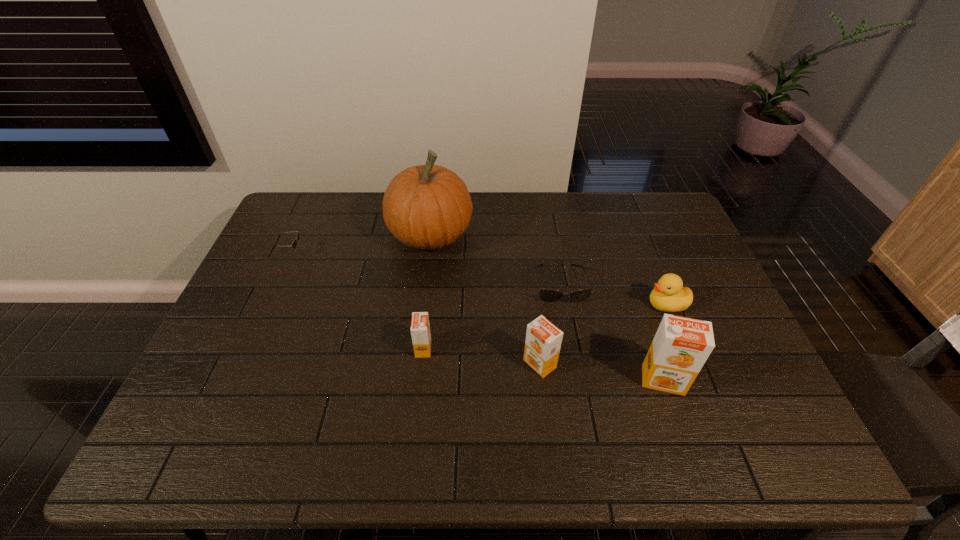
You are a GUI agent. You are given a task and a screenshot of the screen. Output one action in this format:
    pyautogui.click(x=<x>, y=<y>)
    Task: Click on the free space between the tallest object and the right sunglasses
    
    Given the screenshot: What is the action you would take?
    pyautogui.click(x=495, y=260)

Where is `unoccupied position between the leftmost object and the shortest object`? The height and width of the screenshot is (540, 960). unoccupied position between the leftmost object and the shortest object is located at coordinates (426, 269).

Identify the location of unoccupied position between the shortest object and the tallest object. Image resolution: width=960 pixels, height=540 pixels. (495, 260).

I want to click on free point between the leftmost orange juice and the tallest object, so click(427, 292).

The height and width of the screenshot is (540, 960). I want to click on vacant space that is in between the duckling and the left sunglasses, so click(x=479, y=279).

At what (x,y) coordinates should I click in order to perform the action: click on empty space between the shortest object and the duckling. Please return your answer as a coordinate pair (x, y). This screenshot has width=960, height=540. Looking at the image, I should click on (613, 294).

Where is `vacant area between the tallest orange juice and the third tallest object`? The image size is (960, 540). vacant area between the tallest orange juice and the third tallest object is located at coordinates pos(601,372).

Locate an element on the screen. Image resolution: width=960 pixels, height=540 pixels. object that is the third nearest to the leftmost object is located at coordinates (547, 295).

Where is `object that is the second closest one to the shortest orange juice`? This screenshot has height=540, width=960. object that is the second closest one to the shortest orange juice is located at coordinates (428, 206).

The height and width of the screenshot is (540, 960). Find the location of `the closest orange juice to the tallest orange juice`. the closest orange juice to the tallest orange juice is located at coordinates (543, 341).